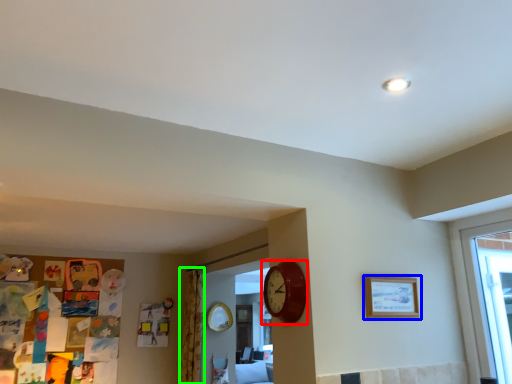
Question: Based on their relative distances, which object is farther from wall clock (highlighted by a red box)? Choose from picture frame (highlighted by a blue box) and curtain (highlighted by a green box).

Choices:
 (A) picture frame
 (B) curtain

Answer: (B)